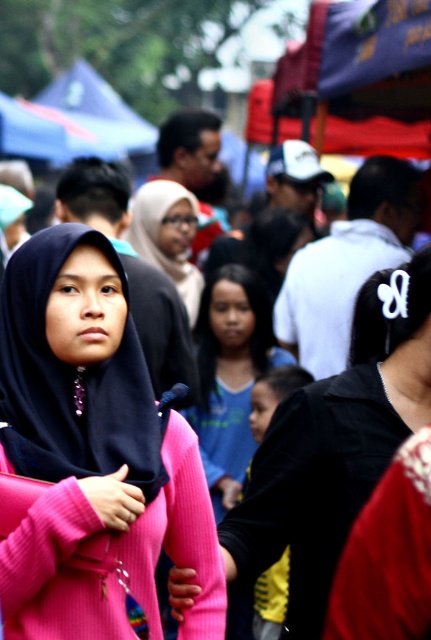
You are a photographer trying to capture both the pink matte sweater at center and the pink ribbed sweater at center in a single shot. Which sweater should you focus on first to ensure both are in clear focus?

You should focus on the pink matte sweater at center first since it is closer to the viewer than the pink ribbed sweater at center. By focusing on the closer object, the farther one will also likely be in focus due to the depth of field.